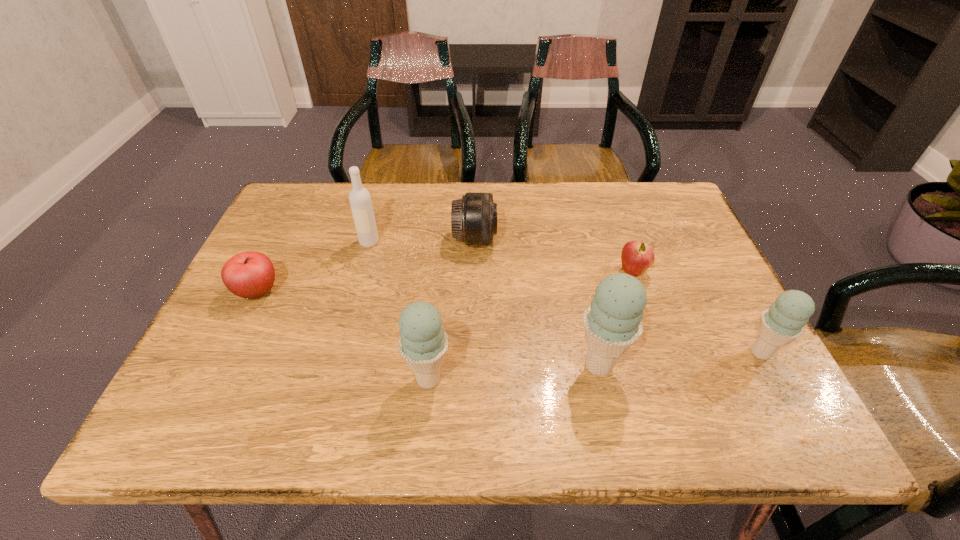
This screenshot has height=540, width=960. I want to click on blank area located 0.050m on the front of the shortest ice cream, so click(x=781, y=390).

Identify the location of vacant region located on the left of the sixth object from right to left. This screenshot has width=960, height=540. (318, 242).

You are a GUI agent. You are given a task and a screenshot of the screen. Output one action in this format:
    pyautogui.click(x=<x>, y=<y>)
    Task: Click on the vacant space located 0.060m on the front-facing side of the telephoto lens
    This screenshot has width=960, height=540.
    Given the screenshot: What is the action you would take?
    pyautogui.click(x=518, y=239)

Locate an element on the screen. This screenshot has height=540, width=960. vacant space located 0.210m on the front of the leftmost object is located at coordinates (210, 389).

Where is `blank space located 0.190m on the left of the second object from right to left`? The height and width of the screenshot is (540, 960). blank space located 0.190m on the left of the second object from right to left is located at coordinates (541, 271).

Find the location of a particular element. This screenshot has height=540, width=960. object at the far edge is located at coordinates (474, 217).

This screenshot has height=540, width=960. In order to click on object located in the left edge section of the desktop in this screenshot , I will do `click(251, 274)`.

What are the coordinates of `object that is positioned at the right edge` in the screenshot? It's located at (784, 321).

This screenshot has height=540, width=960. I want to click on object at the near right corner, so click(784, 321).

Identify the location of free spot at the far edge of the desktop. (386, 208).